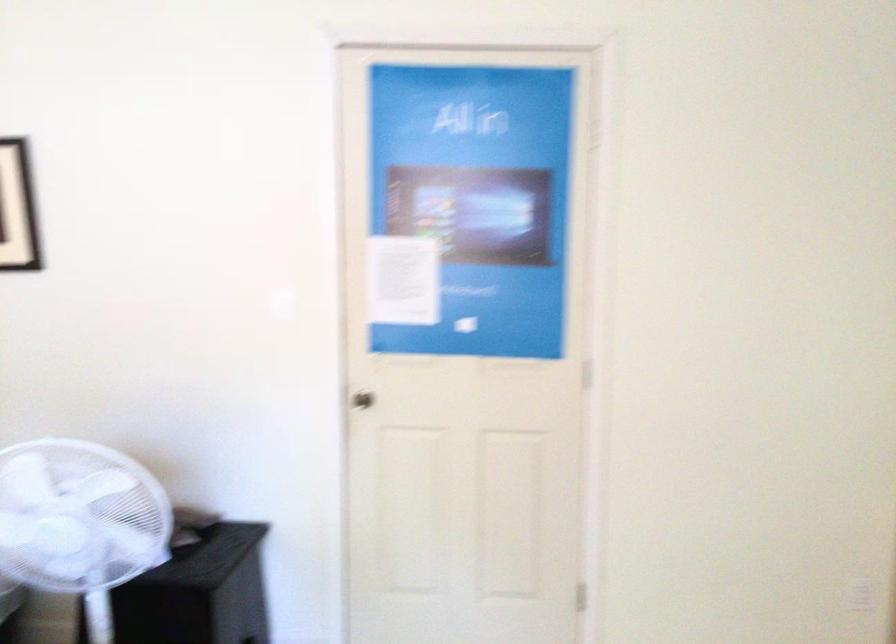
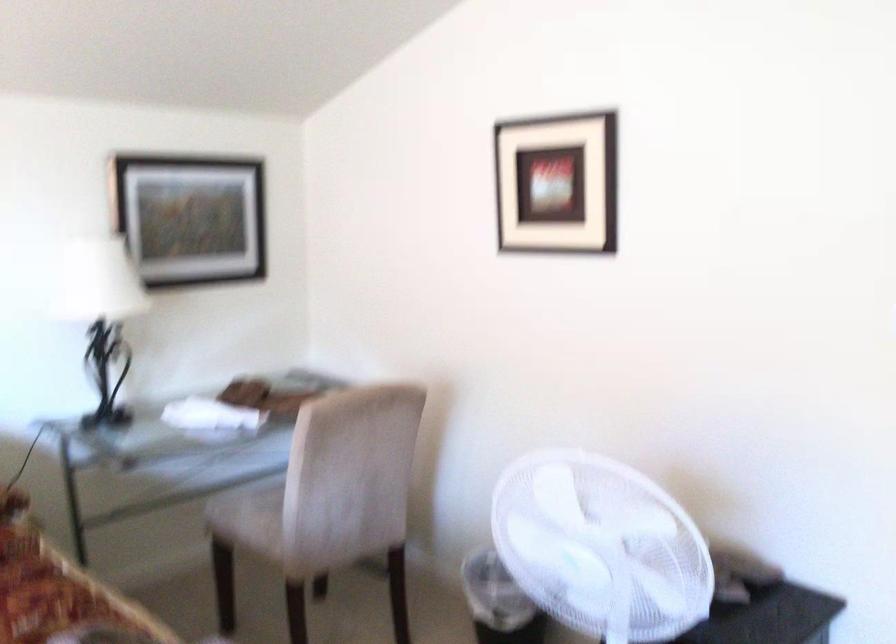
Question: The camera is either moving clockwise (left) or counter-clockwise (right) around the object. The first image is from the beginning of the video and the second image is from the end. Is the camera moving left or right when shooting the video?

Choices:
 (A) Left
 (B) Right

Answer: (B)